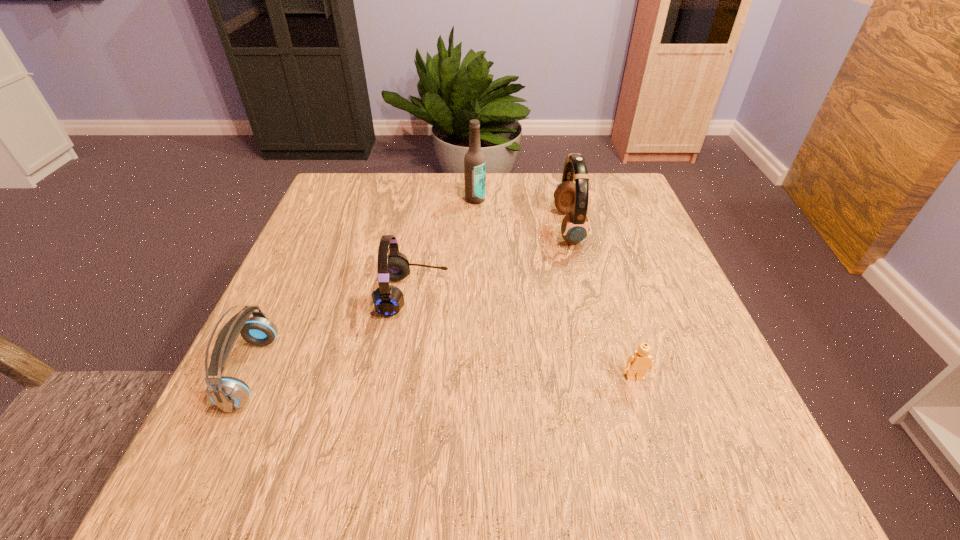
Find the location of a particular element. The width and height of the screenshot is (960, 540). beer bottle is located at coordinates (474, 161).

You are a GUI agent. You are given a task and a screenshot of the screen. Output one action in this format:
    pyautogui.click(x=<x>, y=<y>)
    Task: Click on the farthest object
    Image resolution: width=960 pixels, height=540 pixels.
    Given the screenshot: What is the action you would take?
    pyautogui.click(x=474, y=161)

Locate an element on the screen. The width and height of the screenshot is (960, 540). the tallest headset is located at coordinates (571, 198).

This screenshot has width=960, height=540. I want to click on the fourth shortest object, so point(571,198).

At what (x,y) coordinates should I click in order to perform the action: click on the second headset from right to left. Please return your answer as a coordinate pair (x, y). This screenshot has width=960, height=540. Looking at the image, I should click on (388, 300).

Find the location of a particular element. The height and width of the screenshot is (540, 960). the third nearest object is located at coordinates (388, 300).

In order to click on the nearest headset in this screenshot , I will do `click(228, 393)`.

Where is `the leftmost headset`? The width and height of the screenshot is (960, 540). the leftmost headset is located at coordinates (228, 393).

Identify the location of the shortest object. This screenshot has width=960, height=540. (638, 363).

You are a GUI agent. You are given a task and a screenshot of the screen. Output one action in this format:
    pyautogui.click(x=<x>, y=<y>)
    Task: Click on the vacant point located on the side of the beer bottle with the label
    The image size is (960, 540).
    Given the screenshot: What is the action you would take?
    pyautogui.click(x=474, y=262)